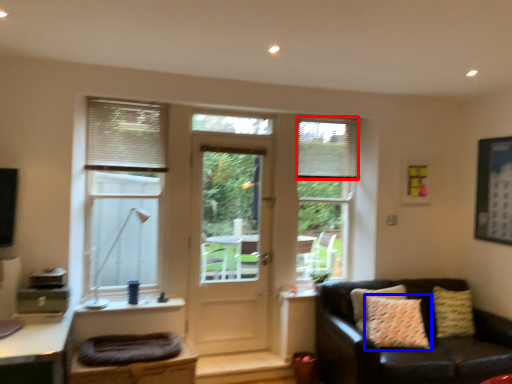
Question: Which point is closer to the camera, shutter (highlighted by a red box) or pillow (highlighted by a blue box)?

Choices:
 (A) shutter
 (B) pillow

Answer: (B)